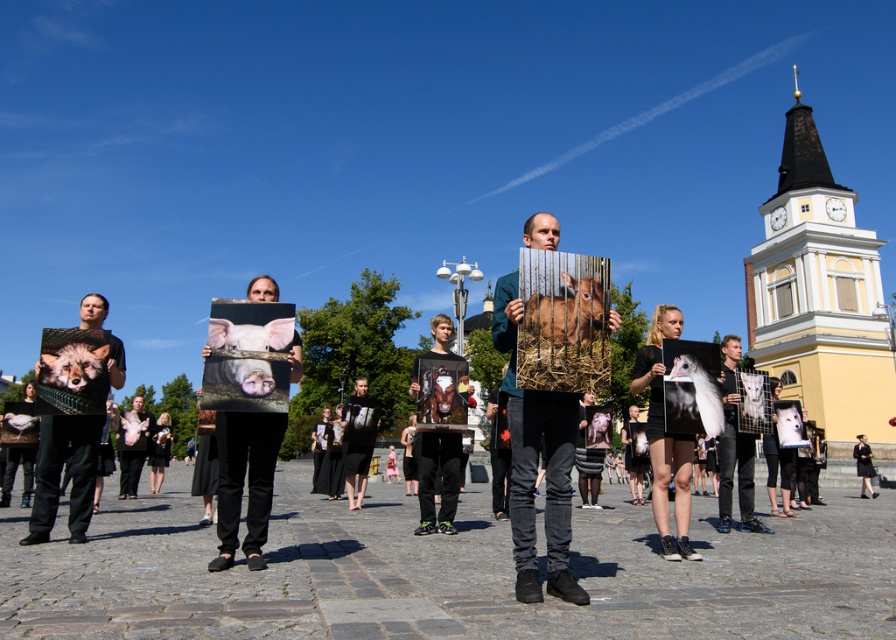
You are a photographer trying to capture a clear shot of the matte black pig at center and the matte black dress at center. Which object is closer to the camera, making it appear more prominent in the photo?

The matte black pig at center is in front of the matte black dress at center, so it is closer to the camera and appears more prominent in the photo.

You are a photographer trying to capture a photo of both the matte black pig at center and the black fabric dress at center in the scene. Given that your camera has a maximum focus range of 60 meters, will you be able to include both subjects in a single shot without moving the camera?

The matte black pig at center and the black fabric dress at center are 62.04 meters apart from each other. Since the camera can only focus up to 60 meters, the distance between them exceeds the maximum focus range. Therefore, you cannot capture both subjects in a single shot without moving the camera.

You are a photographer trying to capture a clear shot of both the matte black pig at center and the black fabric dress at center. Since both are at the same central position, which object should you focus on first to ensure sharpness?

The matte black pig at center has a smaller size compared to the black fabric dress at center, so you should focus on the matte black pig at center first because smaller objects often require precise focusing to capture details clearly.